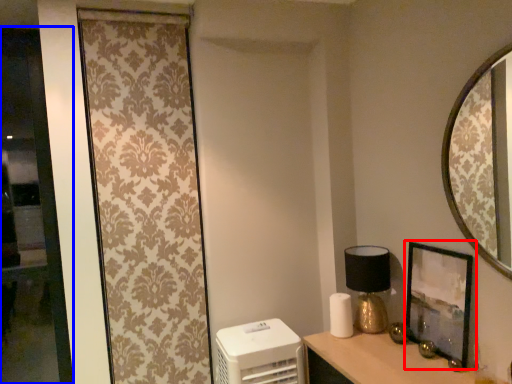
Question: Which object appears farthest to the camera in this image, picture frame (highlighted by a red box) or glass door (highlighted by a blue box)?

Choices:
 (A) picture frame
 (B) glass door

Answer: (B)